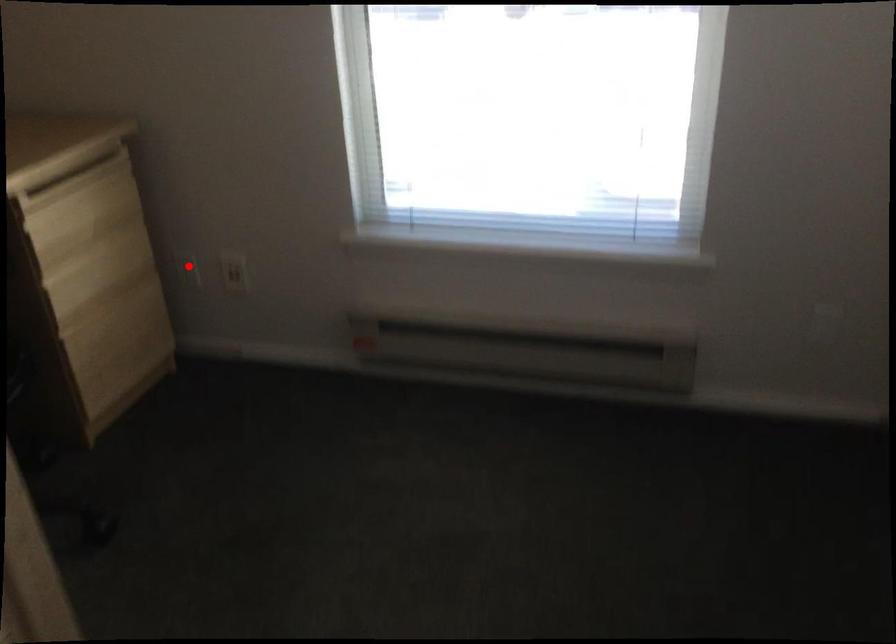
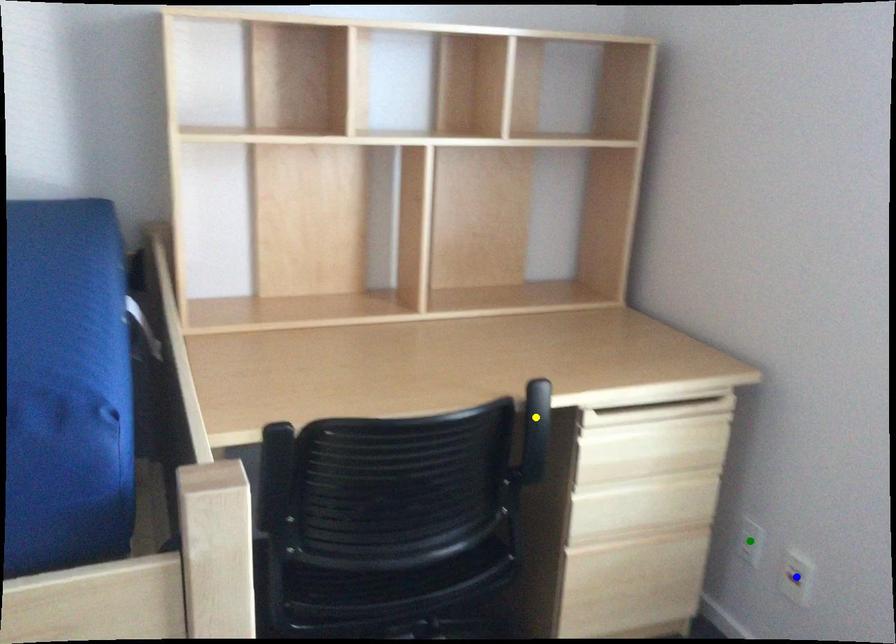
Question: I am providing you with two images of the same scene from different viewpoints. A red point is marked on the first image. You are given multiple points on the second image. Which mark in image 2 goes with the point in image 1?

Choices:
 (A) blue point
 (B) green point
 (C) yellow point

Answer: (B)